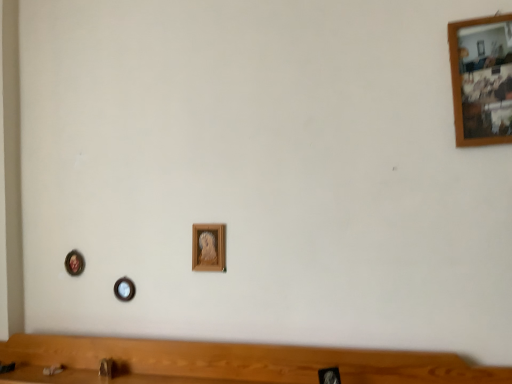
Question: Is wooden picture frame at center, placed as the second picture frame when sorted from front to back, taller than wooden picture frame at upper right, which appears as the 1th picture frame when viewed from the right?

Choices:
 (A) yes
 (B) no

Answer: (B)

Question: Can we say wooden picture frame at center, the 3th picture frame viewed from the left, lies outside wooden picture frame at upper right, which appears as the 4th picture frame when viewed from the back?

Choices:
 (A) no
 (B) yes

Answer: (B)

Question: Is wooden picture frame at center, placed as the second picture frame when sorted from front to back, not close to wooden picture frame at upper right, which appears as the 1th picture frame when viewed from the right?

Choices:
 (A) yes
 (B) no

Answer: (B)

Question: Considering the relative sizes of wooden picture frame at center, placed as the second picture frame when sorted from front to back, and wooden picture frame at upper right, marked as the 4th picture frame in a bottom-to-top arrangement, in the image provided, is wooden picture frame at center, placed as the second picture frame when sorted from front to back, bigger than wooden picture frame at upper right, marked as the 4th picture frame in a bottom-to-top arrangement,?

Choices:
 (A) yes
 (B) no

Answer: (B)

Question: From a real-world perspective, is wooden picture frame at center, which is counted as the third picture frame, starting from the back, positioned over wooden picture frame at upper right, marked as the 4th picture frame in a bottom-to-top arrangement, based on gravity?

Choices:
 (A) no
 (B) yes

Answer: (A)

Question: Is wooden picture frame at center, acting as the 2th picture frame starting from the top, closer to camera compared to wooden picture frame at upper right, the first picture frame when ordered from top to bottom?

Choices:
 (A) yes
 (B) no

Answer: (B)

Question: From the image's perspective, does wooden picture frame at center, the 3th picture frame viewed from the left, appear lower than metallic circular frame at lower left, marked as the 2th picture frame in a bottom-to-top arrangement?

Choices:
 (A) no
 (B) yes

Answer: (A)

Question: From a real-world perspective, is wooden picture frame at center, acting as the 2th picture frame starting from the top, under metallic circular frame at lower left, the third picture frame when ordered from top to bottom?

Choices:
 (A) yes
 (B) no

Answer: (B)

Question: Is the position of wooden picture frame at center, which is the second picture frame in right-to-left order, more distant than that of metallic circular frame at lower left, marked as the 2th picture frame in a bottom-to-top arrangement?

Choices:
 (A) yes
 (B) no

Answer: (B)

Question: Considering the relative positions of wooden picture frame at center, placed as the second picture frame when sorted from front to back, and metallic circular frame at lower left, which is the fourth picture frame from front to back, in the image provided, is wooden picture frame at center, placed as the second picture frame when sorted from front to back, to the left of metallic circular frame at lower left, which is the fourth picture frame from front to back, from the viewer's perspective?

Choices:
 (A) no
 (B) yes

Answer: (A)

Question: Is wooden picture frame at center, the 3th picture frame viewed from the left, aimed at metallic circular frame at lower left, which appears as the 4th picture frame when viewed from the right?

Choices:
 (A) no
 (B) yes

Answer: (A)

Question: Is wooden picture frame at center, which is counted as the third picture frame, starting from the back, not close to metallic circular frame at lower left, which appears as the 4th picture frame when viewed from the right?

Choices:
 (A) yes
 (B) no

Answer: (B)

Question: Is metallic circular frame at lower left, the third picture frame when ordered from top to bottom, to the right of wooden picture frame at center, which is the 3th picture frame from right to left, from the viewer's perspective?

Choices:
 (A) yes
 (B) no

Answer: (B)